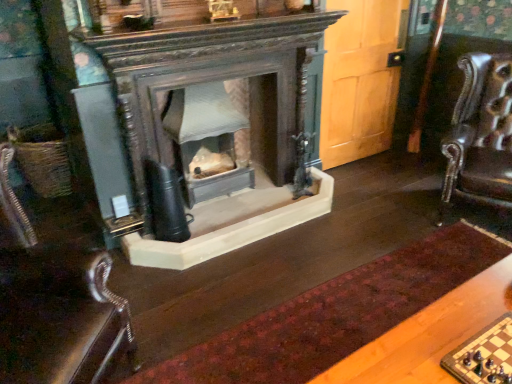
This screenshot has width=512, height=384. What do you see at coordinates (480, 134) in the screenshot?
I see `leather swivel chair at right` at bounding box center [480, 134].

Image resolution: width=512 pixels, height=384 pixels. What are the coordinates of `velvet burgundy rug at center` in the screenshot? It's located at (334, 315).

Locate an element on the screen. This screenshot has width=512, height=384. leather swivel chair at right is located at coordinates (480, 134).

Relative to wooden chessboard at lower right, is leather swivel chair at right in front or behind?

Visually, leather swivel chair at right is located behind wooden chessboard at lower right.

Is leather swivel chair at right situated inside wooden chessboard at lower right or outside?

leather swivel chair at right lies outside wooden chessboard at lower right.

Which of these two, leather swivel chair at right or wooden chessboard at lower right, is thinner?

With smaller width is wooden chessboard at lower right.

Can you confirm if leather swivel chair at right is shorter than wooden chessboard at lower right?

No, leather swivel chair at right is not shorter than wooden chessboard at lower right.

From a real-world perspective, is wooden chessboard at lower right physically below leather at left?

No, from a real-world perspective, wooden chessboard at lower right is not beneath leather at left.

Between point (496, 367) and point (21, 234), which one is positioned behind?

The point (21, 234) is more distant.

The image size is (512, 384). In the image, there is a wooden chessboard at lower right. Identify the location of rocking chair below it (from a real-world perspective). (55, 304).

Considering the sizes of objects wooden chessboard at lower right and leather at left in the image provided, who is wider, wooden chessboard at lower right or leather at left?

leather at left.

Which object is positioned more to the right, wooden chessboard at lower right or velvet burgundy rug at center?

Positioned to the right is wooden chessboard at lower right.

Considering the sizes of objects wooden chessboard at lower right and velvet burgundy rug at center in the image provided, who is wider, wooden chessboard at lower right or velvet burgundy rug at center?

velvet burgundy rug at center.

Is wooden chessboard at lower right looking in the opposite direction of velvet burgundy rug at center?

No, wooden chessboard at lower right is not facing away from velvet burgundy rug at center.

Is wooden chessboard at lower right bigger or smaller than velvet burgundy rug at center?

Considering their sizes, wooden chessboard at lower right takes up less space than velvet burgundy rug at center.

Which point is more distant from viewer, (507, 357) or (458, 120)?

The point (458, 120) is more distant.

Which is more to the left, wooden chessboard at lower right or leather swivel chair at right?

wooden chessboard at lower right is more to the left.

Considering the relative positions of wooden chessboard at lower right and leather swivel chair at right in the image provided, is wooden chessboard at lower right behind leather swivel chair at right?

No, it is not.

Considering the sizes of objects wooden chessboard at lower right and leather swivel chair at right in the image provided, who is shorter, wooden chessboard at lower right or leather swivel chair at right?

With less height is wooden chessboard at lower right.

Identify the location of swivel chair behind the velvet burgundy rug at center. pos(480,134).

Does leather swivel chair at right come in front of velvet burgundy rug at center?

That is False.

From the image's perspective, which object appears higher, leather swivel chair at right or velvet burgundy rug at center?

leather swivel chair at right appears higher in the image.

Based on the photo, is matte glass fireplace at center positioned far away from wooden chessboard at lower right?

That's right, there is a large distance between matte glass fireplace at center and wooden chessboard at lower right.

Looking at their sizes, would you say matte glass fireplace at center is wider or thinner than wooden chessboard at lower right?

matte glass fireplace at center is wider than wooden chessboard at lower right.

Find the location of a particular element. board game on the right side of matte glass fireplace at center is located at coordinates (484, 355).

From a real-world perspective, which is physically below, matte glass fireplace at center or wooden chessboard at lower right?

matte glass fireplace at center, from a real-world perspective.

How different are the orientations of leather at left and velvet burgundy rug at center in degrees?

The facing directions of leather at left and velvet burgundy rug at center are 132 degrees apart.

From the image's perspective, relative to velvet burgundy rug at center, is leather at left above or below?

leather at left is above velvet burgundy rug at center.

Does leather at left have a lesser height compared to velvet burgundy rug at center?

Incorrect, the height of leather at left does not fall short of that of velvet burgundy rug at center.

Based on the photo, how far apart are leather at left and velvet burgundy rug at center?

leather at left and velvet burgundy rug at center are 86.34 centimeters apart.

Identify the location of board game that appears below the leather swivel chair at right (from the image's perspective). (484, 355).

Find the location of `rocking chair that appears on the left of wooden chessboard at lower right`. rocking chair that appears on the left of wooden chessboard at lower right is located at coordinates (55, 304).

Looking at the image, which one is located further to leather at left, velvet burgundy rug at center or wooden chessboard at lower right?

wooden chessboard at lower right lies further to leather at left than the other object.

Consider the image. From the image, which object appears to be nearer to leather swivel chair at right, wooden chessboard at lower right or leather at left?

wooden chessboard at lower right.

When comparing their distances from leather at left, does wooden chessboard at lower right or matte glass fireplace at center seem closer?

Among the two, wooden chessboard at lower right is located nearer to leather at left.

Looking at the image, which one is located further to leather at left, matte glass fireplace at center or wooden chessboard at lower right?

matte glass fireplace at center.

Based on their spatial positions, is leather swivel chair at right or leather at left closer to matte glass fireplace at center?

Among the two, leather at left is located nearer to matte glass fireplace at center.

Based on their spatial positions, is matte glass fireplace at center or leather at left further from wooden chessboard at lower right?

Among the two, matte glass fireplace at center is located further to wooden chessboard at lower right.

Looking at the image, which one is located further to leather swivel chair at right, leather at left or matte glass fireplace at center?

leather at left is further to leather swivel chair at right.

Based on their spatial positions, is leather swivel chair at right or velvet burgundy rug at center closer to leather at left?

velvet burgundy rug at center is closer to leather at left.

Identify the location of board game between matte glass fireplace at center and leather swivel chair at right in the horizontal direction. (484, 355).

Identify the location of board game between leather at left and leather swivel chair at right. (484, 355).

Image resolution: width=512 pixels, height=384 pixels. What are the coordinates of `mat positioned between wooden chessboard at lower right and leather swivel chair at right from near to far` in the screenshot? It's located at (334, 315).

Locate an element on the screen. The width and height of the screenshot is (512, 384). mat between leather at left and matte glass fireplace at center in the front-back direction is located at coordinates (334, 315).